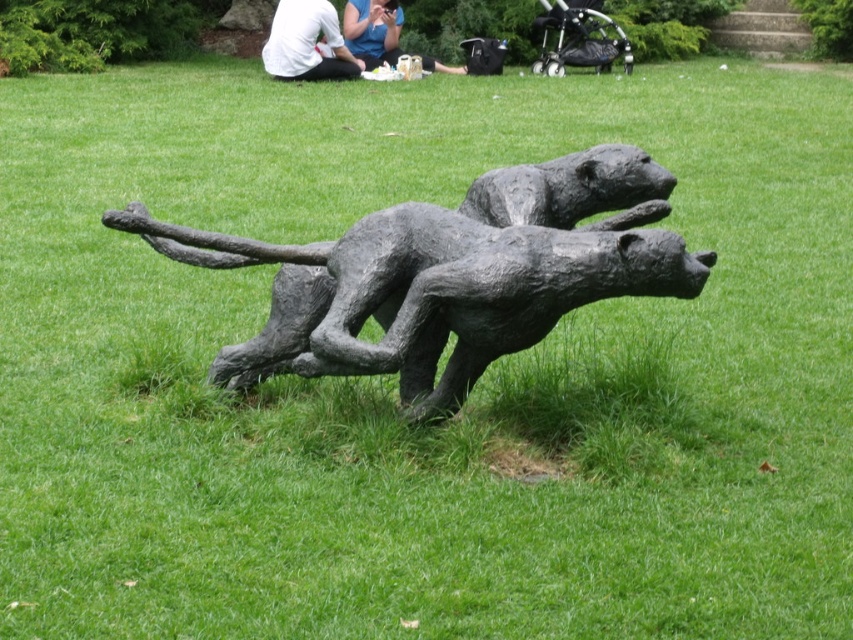
Between point (653, 273) and point (294, 74), which one is positioned in front?

Point (653, 273)

Which is behind, point (508, 188) or point (271, 26)?

The point (271, 26) is more distant.

This screenshot has height=640, width=853. What are the coordinates of `bronze textured sculpture at center` in the screenshot? It's located at (450, 276).

Which of these two, white shirt at upper center or white cotton shirt at upper center, stands taller?

white shirt at upper center is taller.

Which is above, white shirt at upper center or white cotton shirt at upper center?

white cotton shirt at upper center

The height and width of the screenshot is (640, 853). Find the location of `white shirt at upper center`. white shirt at upper center is located at coordinates (306, 44).

Where is `white shirt at upper center`? The width and height of the screenshot is (853, 640). white shirt at upper center is located at coordinates (306, 44).

This screenshot has width=853, height=640. What are the coordinates of `bronze textured sculpture at center` in the screenshot? It's located at (450, 276).

Who is shorter, bronze textured sculpture at center or white cotton shirt at upper center?

With less height is white cotton shirt at upper center.

Is point (477, 296) more distant than point (393, 0)?

No, (477, 296) is in front of (393, 0).

This screenshot has width=853, height=640. In order to click on bronze textured sculpture at center in this screenshot , I will do `click(450, 276)`.